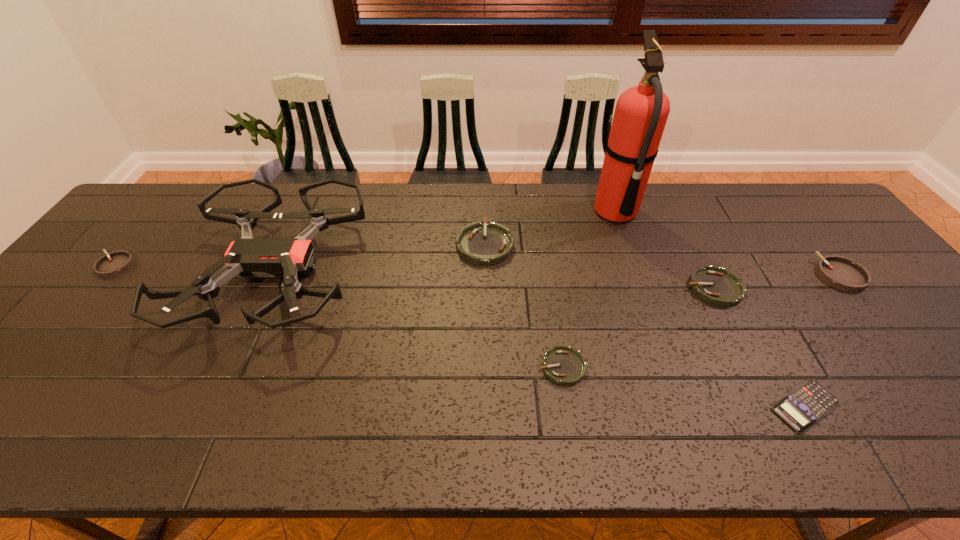
Identify the location of free spot between the farthest green ashtray and the second nearest green ashtray. Image resolution: width=960 pixels, height=540 pixels. (599, 266).

Image resolution: width=960 pixels, height=540 pixels. I want to click on free point between the blue calculator and the second ashtray from left to right, so click(645, 326).

Identify the location of object that is the fifth closest to the fifth object from left to right. This screenshot has height=540, width=960. (802, 408).

This screenshot has height=540, width=960. I want to click on object that is the third closest one to the blue calculator, so click(564, 365).

Image resolution: width=960 pixels, height=540 pixels. Find the location of `ashtray that is the closest one to the drone`. ashtray that is the closest one to the drone is located at coordinates (117, 262).

Select which ashtray appears as the fourth closest to the blue calculator. Please provide its 2D coordinates. Your answer should be formatted as a tuple, i.e. [(x, y)], where the tuple contains the x and y coordinates of a point satisfying the conditions above.

[(491, 243)]

Identify which green ashtray is located as the second nearest to the bigger gray ashtray. Please provide its 2D coordinates. Your answer should be formatted as a tuple, i.e. [(x, y)], where the tuple contains the x and y coordinates of a point satisfying the conditions above.

[(564, 365)]

This screenshot has height=540, width=960. Find the location of `green ashtray that is the second closest to the tallest object`. green ashtray that is the second closest to the tallest object is located at coordinates (491, 243).

This screenshot has width=960, height=540. Identify the location of free location that satisfies the following two spatial constraints: 1. on the front side of the shortest object; 2. on the left side of the left gray ashtray. click(x=0, y=407).

At what (x,y) coordinates should I click in order to perform the action: click on vacant region that satisfies the following two spatial constraints: 1. at the nozzle of the tallest object; 2. on the front side of the smaller gray ashtray. Please return your answer as a coordinate pair (x, y). Looking at the image, I should click on (635, 266).